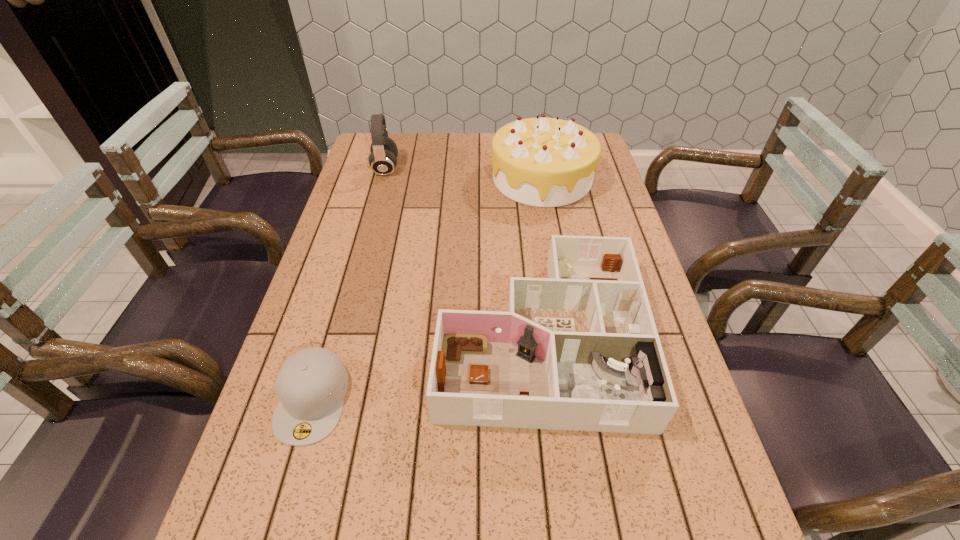
You are a GUI agent. You are given a task and a screenshot of the screen. Output one action in this format:
    pyautogui.click(x=<x>, y=<y>)
    Task: Click on the vacant space that satisfies the following two spatial constraints: 1. on the ear cups of the dollhouse; 2. on the right side of the headset
    This screenshot has height=540, width=960.
    Given the screenshot: What is the action you would take?
    pyautogui.click(x=340, y=337)

Locate an element on the screen. free space that satisfies the following two spatial constraints: 1. on the ear cups of the headset; 2. on the front-facing side of the cap is located at coordinates (324, 399).

At what (x,y) coordinates should I click in order to perform the action: click on vacant space that satisfies the following two spatial constraints: 1. on the ear cups of the headset; 2. on the right side of the third tallest object. Please return your answer as a coordinate pair (x, y). The image size is (960, 540). Looking at the image, I should click on (340, 337).

Where is `free point that satisfies the following two spatial constraints: 1. on the back side of the birthday cake; 2. on the ear cups of the headset`? free point that satisfies the following two spatial constraints: 1. on the back side of the birthday cake; 2. on the ear cups of the headset is located at coordinates (540, 168).